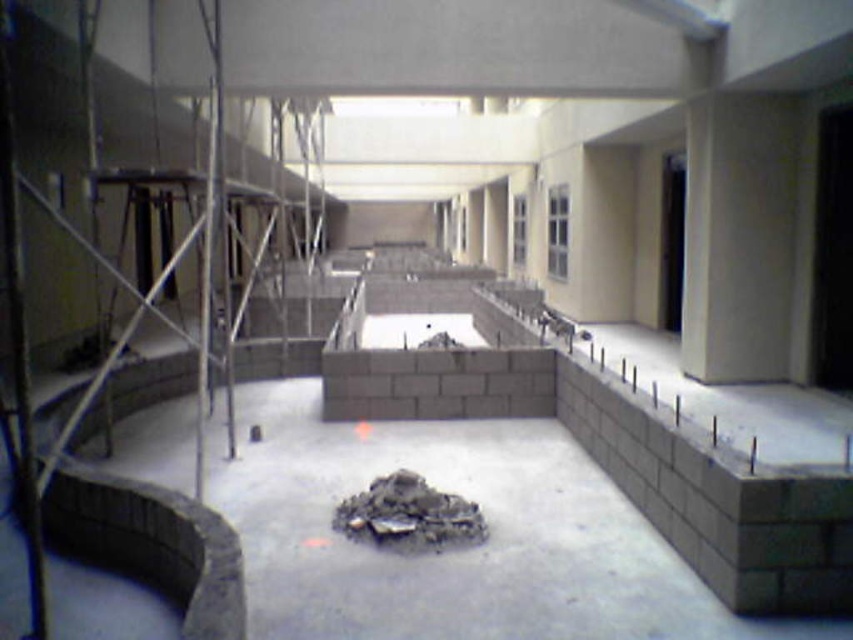
Question: Which point appears closest to the camera in this image?

Choices:
 (A) (62, 131)
 (B) (434, 396)

Answer: (B)

Question: Can you confirm if metal scaffolding at left is smaller than gray concrete block at center?

Choices:
 (A) yes
 (B) no

Answer: (B)

Question: Is the position of metal scaffolding at left less distant than that of gray concrete block at center?

Choices:
 (A) yes
 (B) no

Answer: (A)

Question: Is metal scaffolding at left further to the viewer compared to gray concrete block at center?

Choices:
 (A) no
 (B) yes

Answer: (A)

Question: Which point is closer to the camera?

Choices:
 (A) (202, 156)
 (B) (512, 381)

Answer: (B)